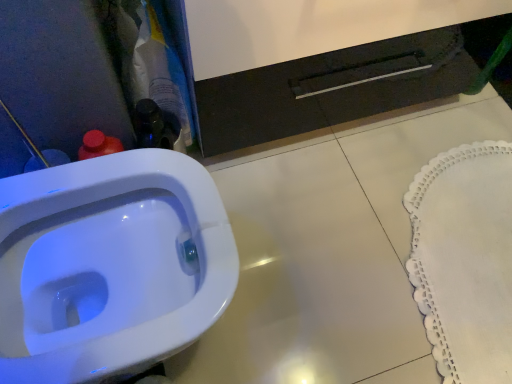
This screenshot has width=512, height=384. In order to click on white glossy toilet at lower left in this screenshot , I will do [109, 265].

The width and height of the screenshot is (512, 384). What do you see at coordinates (109, 265) in the screenshot? I see `white glossy toilet at lower left` at bounding box center [109, 265].

The height and width of the screenshot is (384, 512). Describe the element at coordinates (465, 260) in the screenshot. I see `white lace doily at lower right` at that location.

The image size is (512, 384). I want to click on white lace doily at lower right, so click(x=465, y=260).

Where is `white glossy toilet at lower left`? This screenshot has height=384, width=512. white glossy toilet at lower left is located at coordinates (109, 265).

Between white lace doily at lower right and white glossy toilet at lower left, which one appears on the left side from the viewer's perspective?

From the viewer's perspective, white glossy toilet at lower left appears more on the left side.

Is white lace doily at lower right further to the viewer compared to white glossy toilet at lower left?

Yes, white lace doily at lower right is further from the camera.

Considering the positions of points (431, 337) and (119, 182), is point (431, 337) closer to camera compared to point (119, 182)?

No, it is not.

From the image's perspective, is white lace doily at lower right beneath white glossy toilet at lower left?

Incorrect, from the image's perspective, white lace doily at lower right is higher than white glossy toilet at lower left.

From a real-world perspective, is white lace doily at lower right physically below white glossy toilet at lower left?

Yes, from a real-world perspective, white lace doily at lower right is beneath white glossy toilet at lower left.

Which of these two, white lace doily at lower right or white glossy toilet at lower left, is wider?

white glossy toilet at lower left.

Based on the photo, considering the sizes of white lace doily at lower right and white glossy toilet at lower left in the image, is white lace doily at lower right taller or shorter than white glossy toilet at lower left?

Clearly, white lace doily at lower right is shorter compared to white glossy toilet at lower left.

Considering the sizes of objects white lace doily at lower right and white glossy toilet at lower left in the image provided, who is bigger, white lace doily at lower right or white glossy toilet at lower left?

white glossy toilet at lower left.

Is white glossy toilet at lower left a part of white lace doily at lower right?

No, white glossy toilet at lower left is not surrounded by white lace doily at lower right.

Is white lace doily at lower right far from white glossy toilet at lower left?

No, white lace doily at lower right is not far from white glossy toilet at lower left.

Does white lace doily at lower right turn towards white glossy toilet at lower left?

Yes, white lace doily at lower right is oriented towards white glossy toilet at lower left.

What's the angular difference between white lace doily at lower right and white glossy toilet at lower left's facing directions?

180 degrees.

At what (x,y) coordinates should I click in order to perform the action: click on bath mat above the white glossy toilet at lower left (from the image's perspective). Please return your answer as a coordinate pair (x, y). Looking at the image, I should click on (465, 260).

Can you confirm if white glossy toilet at lower left is positioned to the left of white lace doily at lower right?

Yes.

Between white glossy toilet at lower left and white lace doily at lower right, which one is positioned in front?

Positioned in front is white glossy toilet at lower left.

Which point is more forward, (x=53, y=374) or (x=417, y=268)?

The point (x=53, y=374) is more forward.

From the image's perspective, would you say white glossy toilet at lower left is positioned over white lace doily at lower right?

No, from the image's perspective, white glossy toilet at lower left is not above white lace doily at lower right.

Based on the photo, from a real-world perspective, is white glossy toilet at lower left on top of white lace doily at lower right?

Yes.

Does white glossy toilet at lower left have a lesser width compared to white lace doily at lower right?

Incorrect, the width of white glossy toilet at lower left is not less than that of white lace doily at lower right.

Between white glossy toilet at lower left and white lace doily at lower right, which one has more height?

white glossy toilet at lower left.

Looking at this image, considering the relative sizes of white glossy toilet at lower left and white lace doily at lower right in the image provided, is white glossy toilet at lower left smaller than white lace doily at lower right?

Incorrect, white glossy toilet at lower left is not smaller in size than white lace doily at lower right.

Which is correct: white glossy toilet at lower left is inside white lace doily at lower right, or outside of it?

white glossy toilet at lower left is not enclosed by white lace doily at lower right.

Is white glossy toilet at lower left next to white lace doily at lower right and touching it?

They are not placed beside each other.

Does white glossy toilet at lower left turn towards white lace doily at lower right?

Yes, white glossy toilet at lower left faces towards white lace doily at lower right.

What's the angular difference between white glossy toilet at lower left and white lace doily at lower right's facing directions?

There is a 180-degree angle between the facing directions of white glossy toilet at lower left and white lace doily at lower right.

Identify the location of bath mat below the white glossy toilet at lower left (from a real-world perspective). Image resolution: width=512 pixels, height=384 pixels. (465, 260).

In the image, there is a white glossy toilet at lower left. Identify the location of bath mat above it (from the image's perspective). (465, 260).

Locate an element on the screen. bath mat lying on the right of white glossy toilet at lower left is located at coordinates (465, 260).